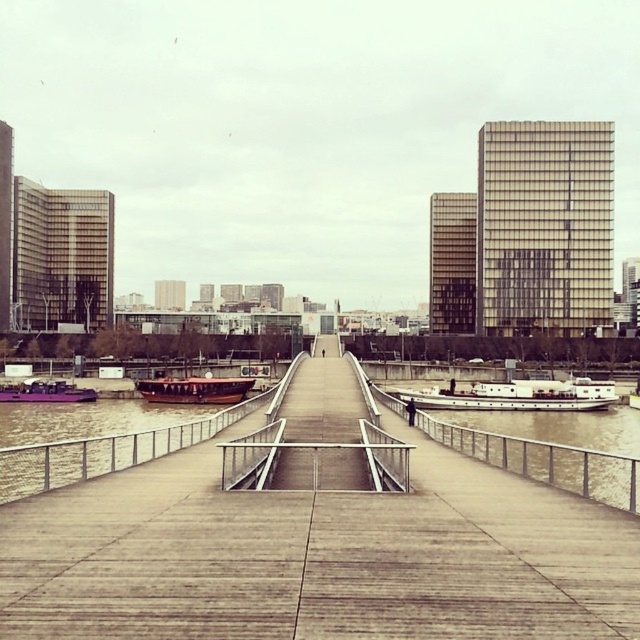
Question: Which is farther from the matte purple boat at lower left?

Choices:
 (A) metallic silver rail at center
 (B) concrete dock at center

Answer: (A)

Question: Which of these objects is positioned farthest from the metallic silver rail at center?

Choices:
 (A) white matte barge at center-right
 (B) metallic silver dock at center

Answer: (A)

Question: Is white matte barge at center-right thinner than matte purple boat at lower left?

Choices:
 (A) no
 (B) yes

Answer: (A)

Question: Can you confirm if metallic silver rail at center is thinner than matte purple boat at lower left?

Choices:
 (A) yes
 (B) no

Answer: (A)

Question: Which object appears closest to the camera in this image?

Choices:
 (A) wooden polished boat at center
 (B) concrete dock at center
 (C) matte purple boat at lower left
 (D) metallic silver dock at center

Answer: (B)

Question: Is concrete dock at center to the left of wooden polished boat at center from the viewer's perspective?

Choices:
 (A) yes
 (B) no

Answer: (B)